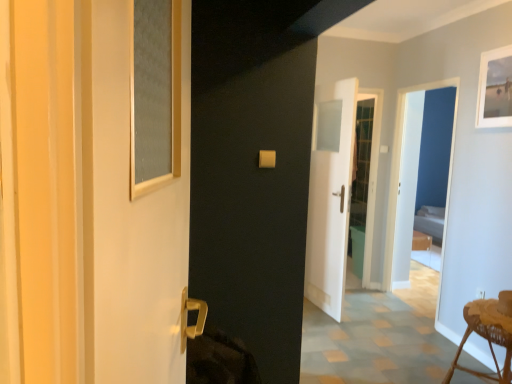
Question: Is white fabric bed at right completely or partially inside white matte picture frame at upper right?

Choices:
 (A) yes
 (B) no

Answer: (B)

Question: Considering the relative sizes of white matte picture frame at upper right and white fabric bed at right in the image provided, is white matte picture frame at upper right taller than white fabric bed at right?

Choices:
 (A) yes
 (B) no

Answer: (B)

Question: Is white matte picture frame at upper right not within white fabric bed at right?

Choices:
 (A) no
 (B) yes

Answer: (B)

Question: From a real-world perspective, is white matte picture frame at upper right below white fabric bed at right?

Choices:
 (A) no
 (B) yes

Answer: (A)

Question: Is white matte picture frame at upper right positioned behind white fabric bed at right?

Choices:
 (A) yes
 (B) no

Answer: (B)

Question: From a real-world perspective, is white matte picture frame at upper right physically above white fabric bed at right?

Choices:
 (A) yes
 (B) no

Answer: (A)

Question: Can you confirm if matte glass screen door at left, which is counted as the 2th screen door, starting from the back, is shorter than white fabric bed at right?

Choices:
 (A) yes
 (B) no

Answer: (B)

Question: Considering the relative sizes of matte glass screen door at left, which ranks as the 2th screen door in right-to-left order, and white fabric bed at right in the image provided, is matte glass screen door at left, which ranks as the 2th screen door in right-to-left order, thinner than white fabric bed at right?

Choices:
 (A) yes
 (B) no

Answer: (A)

Question: Is there a large distance between matte glass screen door at left, which is counted as the 2th screen door, starting from the back, and white fabric bed at right?

Choices:
 (A) yes
 (B) no

Answer: (A)

Question: Considering the relative sizes of matte glass screen door at left, which ranks as the 2th screen door in right-to-left order, and white fabric bed at right in the image provided, is matte glass screen door at left, which ranks as the 2th screen door in right-to-left order, bigger than white fabric bed at right?

Choices:
 (A) yes
 (B) no

Answer: (B)

Question: Is matte glass screen door at left, the first screen door in the front-to-back sequence, with white fabric bed at right?

Choices:
 (A) yes
 (B) no

Answer: (B)

Question: Is matte glass screen door at left, the first screen door in the front-to-back sequence, oriented away from white fabric bed at right?

Choices:
 (A) no
 (B) yes

Answer: (A)

Question: Is woven wood stool at lower right directly adjacent to white fabric bed at right?

Choices:
 (A) yes
 (B) no

Answer: (B)